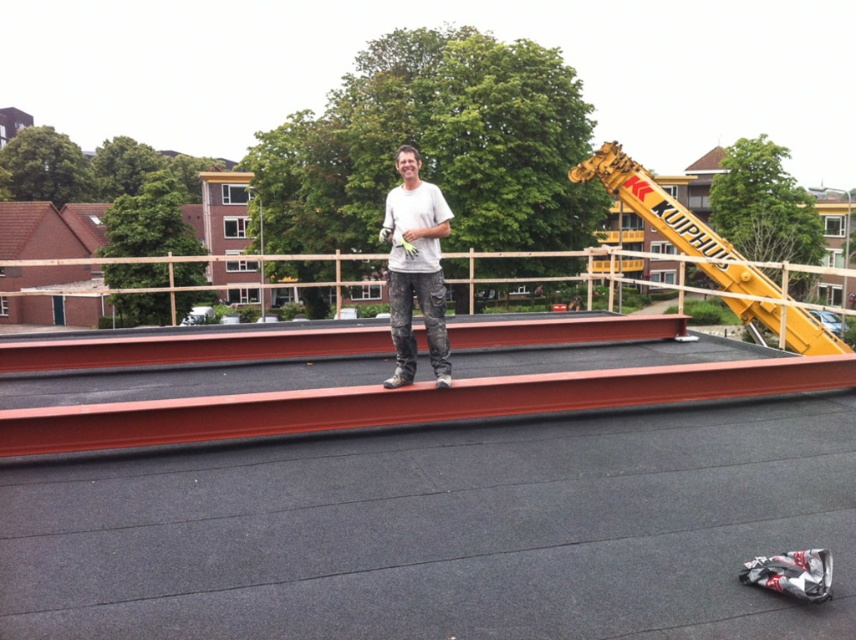
You are a safety inspector on the construction site. You see the red steel beams at center and the white matte shirt at center. Which object is closer to you?

The red steel beams at center are closer to you because they are in front of the white matte shirt at center.

You are a safety inspector at the construction site. You notice the red steel beams at center and the white matte shirt at center. According to safety regulations, all workers must maintain a distance of at least 2 meters from any object shorter than their clothing. Is the worker complying with this rule?

The red steel beams at center is shorter than the white matte shirt at center. Since the red steel beams at center is shorter than the worker, the worker must maintain a distance of at least 2 meters. However, the description does not provide information about the actual distance between the worker and the beams, so compliance cannot be confirmed.

You are a construction worker standing on the rooftop. You need to place a new steel beam exactly at the center of the rooftop. However, there are already red steel beams at center. Can you still place your beam at the center without overlapping?

The red steel beams at center are already located at the center of the rooftop at point (403, 403), so placing another beam there would cause an overlap. Choose a different location.